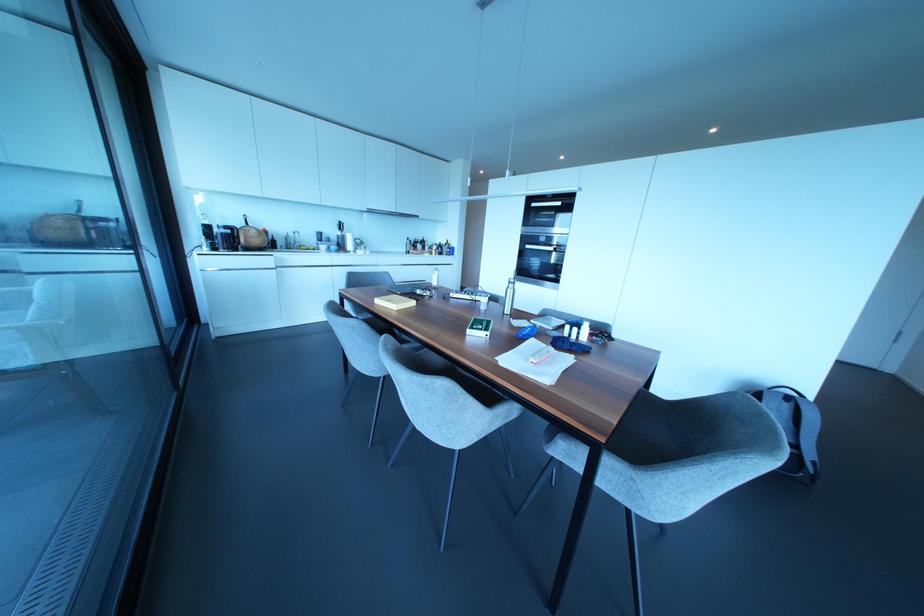
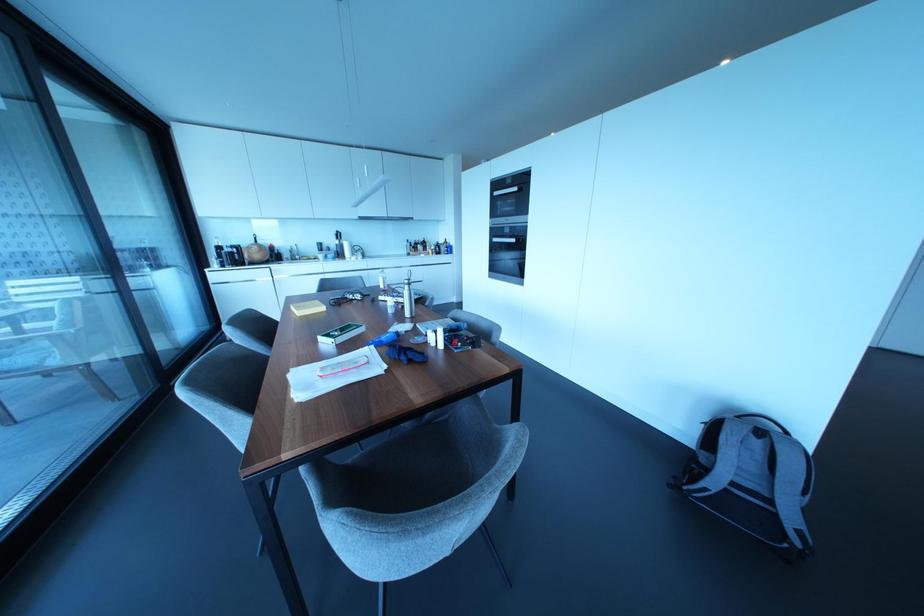
Locate, in the second image, the point that corresponds to the point at 411,302 in the first image.

(322, 308)